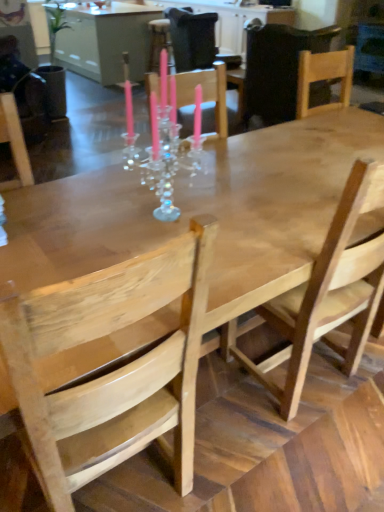
Where is `natural wood chair at center, which ranks as the 3th chair in back-to-front order`? natural wood chair at center, which ranks as the 3th chair in back-to-front order is located at coordinates (329, 292).

This screenshot has width=384, height=512. Describe the element at coordinates (107, 374) in the screenshot. I see `natural wood chair at left, placed as the fourth chair when sorted from back to front` at that location.

Locate an element on the screen. The image size is (384, 512). wooden chair at center, the fourth chair viewed from the front is located at coordinates (196, 40).

Is wooden table at center positioned before natural wood chair at center, the 2th chair from the front?

No, it is not.

Is wooden table at center positioned beyond the bounds of natural wood chair at center, the 2th chair from the front?

That's correct, wooden table at center is outside of natural wood chair at center, the 2th chair from the front.

How different are the orientations of wooden table at center and natural wood chair at center, the 2th chair from the front, in degrees?

95.7 degrees separate the facing orientations of wooden table at center and natural wood chair at center, the 2th chair from the front.

From the image's perspective, between wooden table at center and natural wood chair at center, the 2th chair from the front, which one is located above?

wooden table at center, from the image's perspective.

What's the angular difference between wooden table at center and natural wood chair at left, placed as the fourth chair when sorted from back to front,'s facing directions?

The facing directions of wooden table at center and natural wood chair at left, placed as the fourth chair when sorted from back to front, are 95.7 degrees apart.

Can you see wooden table at center touching natural wood chair at left, placed as the fourth chair when sorted from back to front?

There is a gap between wooden table at center and natural wood chair at left, placed as the fourth chair when sorted from back to front.

Which of these two, wooden table at center or natural wood chair at left, placed as the fourth chair when sorted from back to front, stands shorter?

With less height is wooden table at center.

Is wooden table at center looking in the opposite direction of natural wood chair at left, placed as the first chair when sorted from front to back?

wooden table at center does not have its back to natural wood chair at left, placed as the first chair when sorted from front to back.

From the image's perspective, does natural wood chair at left, placed as the first chair when sorted from front to back, appear lower than natural wood chair at upper right, the 3th chair from the front?

Yes, from the image's perspective, natural wood chair at left, placed as the first chair when sorted from front to back, is beneath natural wood chair at upper right, the 3th chair from the front.

Between natural wood chair at left, placed as the fourth chair when sorted from back to front, and natural wood chair at upper right, the 3th chair from the front, which one has less height?

natural wood chair at upper right, the 3th chair from the front, is shorter.

Does natural wood chair at left, placed as the first chair when sorted from front to back, lie in front of natural wood chair at upper right, the 3th chair from the front?

Yes, the depth of natural wood chair at left, placed as the first chair when sorted from front to back, is less than that of natural wood chair at upper right, the 3th chair from the front.

In the scene shown: Does natural wood chair at left, placed as the first chair when sorted from front to back, appear on the right side of natural wood chair at upper right, the second chair from the back?

In fact, natural wood chair at left, placed as the first chair when sorted from front to back, is to the left of natural wood chair at upper right, the second chair from the back.

How many degrees apart are the facing directions of natural wood chair at upper right, the 3th chair from the front, and wooden chair at center, the first chair viewed from the back?

The angular difference between natural wood chair at upper right, the 3th chair from the front, and wooden chair at center, the first chair viewed from the back, is 34.6 degrees.

From a real-world perspective, is natural wood chair at upper right, the second chair from the back, beneath wooden chair at center, the fourth chair viewed from the front?

No, from a real-world perspective, natural wood chair at upper right, the second chair from the back, is not beneath wooden chair at center, the fourth chair viewed from the front.

From the image's perspective, is natural wood chair at upper right, the 3th chair from the front, located above or below wooden chair at center, the fourth chair viewed from the front?

Clearly, from the image's perspective, natural wood chair at upper right, the 3th chair from the front, is below wooden chair at center, the fourth chair viewed from the front.

Would you consider natural wood chair at upper right, the 3th chair from the front, to be distant from wooden chair at center, the first chair viewed from the back?

Actually, natural wood chair at upper right, the 3th chair from the front, and wooden chair at center, the first chair viewed from the back, are a little close together.

Considering the positions of objects wooden chair at center, the fourth chair viewed from the front, and natural wood chair at left, placed as the fourth chair when sorted from back to front, in the image provided, who is more to the left, wooden chair at center, the fourth chair viewed from the front, or natural wood chair at left, placed as the fourth chair when sorted from back to front,?

From the viewer's perspective, natural wood chair at left, placed as the fourth chair when sorted from back to front, appears more on the left side.

Based on their sizes in the image, would you say wooden chair at center, the fourth chair viewed from the front, is bigger or smaller than natural wood chair at left, placed as the first chair when sorted from front to back?

In the image, wooden chair at center, the fourth chair viewed from the front, appears to be larger than natural wood chair at left, placed as the first chair when sorted from front to back.

Measure the distance from wooden chair at center, the first chair viewed from the back, to natural wood chair at left, placed as the first chair when sorted from front to back.

A distance of 4.00 meters exists between wooden chair at center, the first chair viewed from the back, and natural wood chair at left, placed as the first chair when sorted from front to back.

Considering the sizes of objects wooden table at center and natural wood chair at upper right, the 3th chair from the front, in the image provided, who is thinner, wooden table at center or natural wood chair at upper right, the 3th chair from the front,?

natural wood chair at upper right, the 3th chair from the front.

Which object is more forward, wooden table at center or natural wood chair at upper right, the second chair from the back?

natural wood chair at upper right, the second chair from the back, is in front.

Based on the photo, from a real-world perspective, between wooden table at center and natural wood chair at upper right, the second chair from the back, who is vertically higher?

natural wood chair at upper right, the second chair from the back, is physically above.

Is wooden table at center placed right next to natural wood chair at upper right, the 3th chair from the front?

No, wooden table at center is not in contact with natural wood chair at upper right, the 3th chair from the front.

Can you confirm if natural wood chair at left, placed as the fourth chair when sorted from back to front, is positioned to the left of natural wood chair at center, the 2th chair from the front?

Correct, you'll find natural wood chair at left, placed as the fourth chair when sorted from back to front, to the left of natural wood chair at center, the 2th chair from the front.

Can you confirm if natural wood chair at left, placed as the first chair when sorted from front to back, is thinner than natural wood chair at center, the 2th chair from the front?

No, natural wood chair at left, placed as the first chair when sorted from front to back, is not thinner than natural wood chair at center, the 2th chair from the front.

Can natural wood chair at center, which ranks as the 3th chair in back-to-front order, be found inside natural wood chair at left, placed as the first chair when sorted from front to back?

That's incorrect, natural wood chair at center, which ranks as the 3th chair in back-to-front order, is not inside natural wood chair at left, placed as the first chair when sorted from front to back.

This screenshot has width=384, height=512. What are the coordinates of `the 3rd chair below when counting from the wooden table at center (from the image's perspective)` in the screenshot? It's located at (329, 292).

Starting from the wooden table at center, which chair is the 1st one to the right? Please provide its 2D coordinates.

[(107, 374)]

Considering their positions, is wooden chair at center, the fourth chair viewed from the front, positioned further to natural wood chair at center, the 2th chair from the front, than wooden table at center?

wooden table at center is further to natural wood chair at center, the 2th chair from the front.

Consider the image. Estimate the real-world distances between objects in this image. Which object is further from wooden table at center, wooden chair at center, the fourth chair viewed from the front, or natural wood chair at center, the 2th chair from the front?

natural wood chair at center, the 2th chair from the front, is further to wooden table at center.

From the image, which object appears to be nearer to wooden chair at center, the first chair viewed from the back, natural wood chair at center, the 2th chair from the front, or natural wood chair at upper right, the 3th chair from the front?

Based on the image, natural wood chair at upper right, the 3th chair from the front, appears to be nearer to wooden chair at center, the first chair viewed from the back.

Considering their positions, is wooden table at center positioned closer to wooden chair at center, the first chair viewed from the back, than natural wood chair at upper right, the second chair from the back?

The object closer to wooden chair at center, the first chair viewed from the back, is natural wood chair at upper right, the second chair from the back.

Estimate the real-world distances between objects in this image. Which object is further from natural wood chair at upper right, the 3th chair from the front, natural wood chair at left, placed as the first chair when sorted from front to back, or wooden table at center?

Based on the image, natural wood chair at left, placed as the first chair when sorted from front to back, appears to be further to natural wood chair at upper right, the 3th chair from the front.

Estimate the real-world distances between objects in this image. Which object is further from wooden chair at center, the first chair viewed from the back, wooden table at center or natural wood chair at center, which ranks as the 3th chair in back-to-front order?

natural wood chair at center, which ranks as the 3th chair in back-to-front order.

From the image, which object appears to be nearer to natural wood chair at center, the 2th chair from the front, natural wood chair at upper right, the second chair from the back, or natural wood chair at left, placed as the fourth chair when sorted from back to front?

The object closer to natural wood chair at center, the 2th chair from the front, is natural wood chair at left, placed as the fourth chair when sorted from back to front.

Estimate the real-world distances between objects in this image. Which object is closer to wooden table at center, natural wood chair at left, placed as the fourth chair when sorted from back to front, or wooden chair at center, the first chair viewed from the back?

wooden chair at center, the first chair viewed from the back, is positioned closer to the anchor wooden table at center.

This screenshot has height=512, width=384. I want to click on chair between natural wood chair at left, placed as the first chair when sorted from front to back, and natural wood chair at upper right, the 3th chair from the front, along the z-axis, so click(x=329, y=292).

Where is `chair between natural wood chair at center, which ranks as the 3th chair in back-to-front order, and wooden chair at center, the fourth chair viewed from the front, in the front-back direction`? The image size is (384, 512). chair between natural wood chair at center, which ranks as the 3th chair in back-to-front order, and wooden chair at center, the fourth chair viewed from the front, in the front-back direction is located at coordinates click(x=277, y=69).